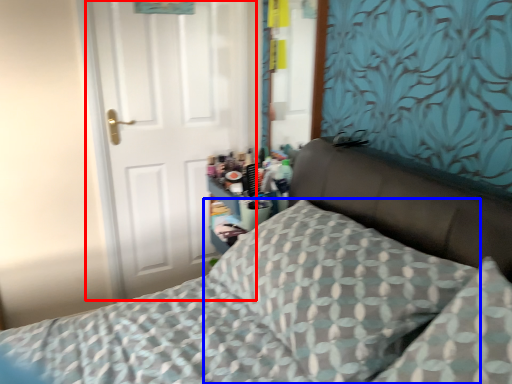
Question: Among these objects, which one is farthest to the camera, door (highlighted by a red box) or pillow (highlighted by a blue box)?

Choices:
 (A) door
 (B) pillow

Answer: (A)